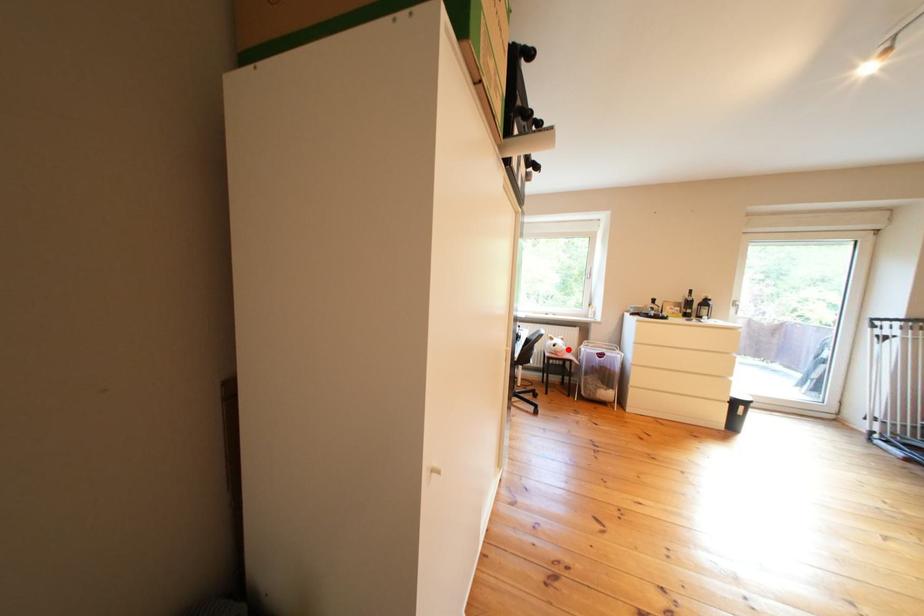
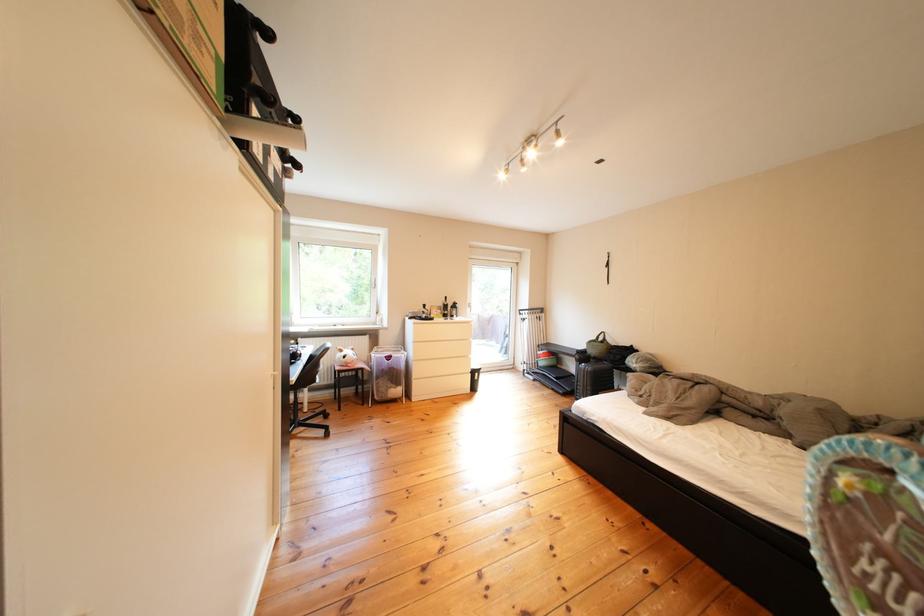
In the second image, find the point that corresponds to the highlighted location in the first image.

(359, 361)